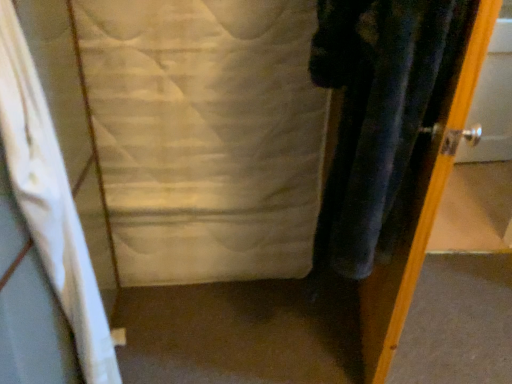
Question: Can you see white quilted fabric at center touching white fabric curtain at left?

Choices:
 (A) no
 (B) yes

Answer: (A)

Question: Can you confirm if white quilted fabric at center is positioned to the left of white fabric curtain at left?

Choices:
 (A) yes
 (B) no

Answer: (B)

Question: Does white quilted fabric at center have a smaller size compared to white fabric curtain at left?

Choices:
 (A) no
 (B) yes

Answer: (A)

Question: Can you confirm if white quilted fabric at center is positioned to the right of white fabric curtain at left?

Choices:
 (A) yes
 (B) no

Answer: (A)

Question: From a real-world perspective, is white quilted fabric at center positioned over white fabric curtain at left based on gravity?

Choices:
 (A) no
 (B) yes

Answer: (A)

Question: From the image's perspective, relative to white fabric curtain at left, is metallic silver door at right above or below?

Choices:
 (A) below
 (B) above

Answer: (B)

Question: Considering the positions of point (458, 34) and point (69, 271), is point (458, 34) closer or farther from the camera than point (69, 271)?

Choices:
 (A) closer
 (B) farther

Answer: (A)

Question: Considering the relative positions of metallic silver door at right and white fabric curtain at left in the image provided, is metallic silver door at right to the left or to the right of white fabric curtain at left?

Choices:
 (A) right
 (B) left

Answer: (A)

Question: Considering their positions, is metallic silver door at right located in front of or behind white fabric curtain at left?

Choices:
 (A) front
 (B) behind

Answer: (B)

Question: Is white fabric curtain at left to the left or to the right of white quilted fabric at center in the image?

Choices:
 (A) left
 (B) right

Answer: (A)

Question: Is white fabric curtain at left spatially inside white quilted fabric at center, or outside of it?

Choices:
 (A) outside
 (B) inside

Answer: (A)

Question: From their relative heights in the image, would you say white fabric curtain at left is taller or shorter than white quilted fabric at center?

Choices:
 (A) short
 (B) tall

Answer: (B)

Question: In the image, is white fabric curtain at left positioned in front of or behind white quilted fabric at center?

Choices:
 (A) front
 (B) behind

Answer: (A)

Question: Is point (173, 231) closer or farther from the camera than point (38, 193)?

Choices:
 (A) closer
 (B) farther

Answer: (B)

Question: From the image's perspective, is white quilted fabric at center above or below white fabric curtain at left?

Choices:
 (A) above
 (B) below

Answer: (A)